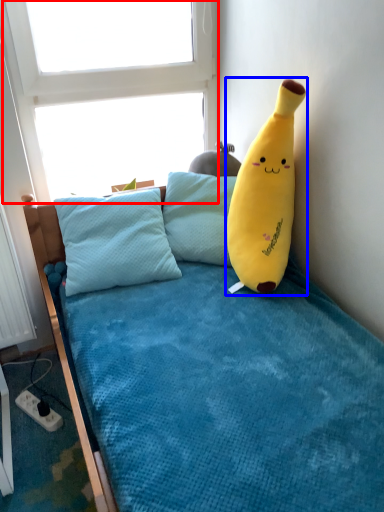
Question: Which object is further to the camera taking this photo, window screen (highlighted by a red box) or toy (highlighted by a blue box)?

Choices:
 (A) window screen
 (B) toy

Answer: (A)